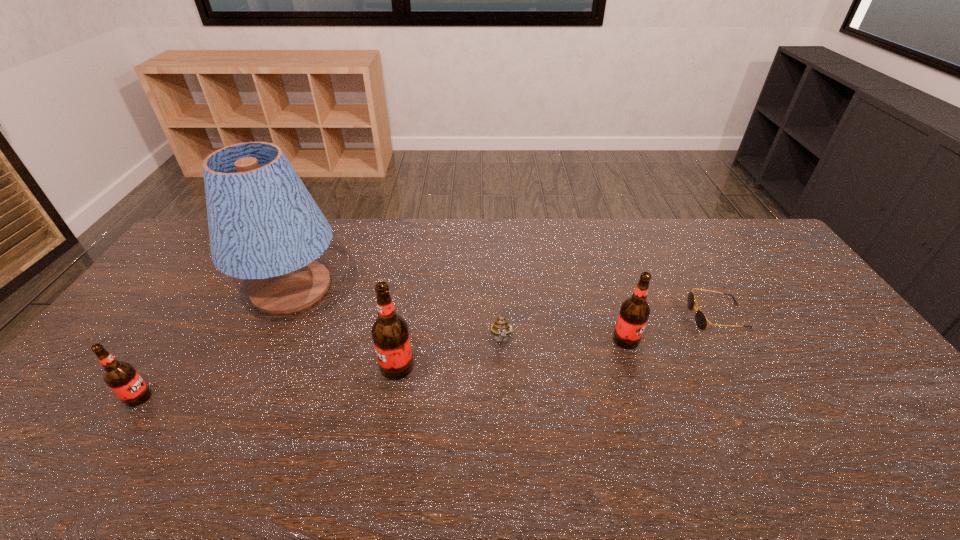
Identify the location of the leftmost object. (121, 377).

At what (x,y) coordinates should I click in order to perform the action: click on the leftmost root beer. Please return your answer as a coordinate pair (x, y). The height and width of the screenshot is (540, 960). Looking at the image, I should click on (121, 377).

You are a GUI agent. You are given a task and a screenshot of the screen. Output one action in this format:
    pyautogui.click(x=<x>, y=<y>)
    Task: Click on the second nearest root beer
    The width and height of the screenshot is (960, 540).
    Given the screenshot: What is the action you would take?
    390,333

The height and width of the screenshot is (540, 960). In order to click on the tallest root beer in this screenshot , I will do `click(390, 333)`.

This screenshot has width=960, height=540. Identify the location of the farthest root beer. (634, 312).

Find the location of a particular element. Image resolution: width=960 pixels, height=540 pixels. the fifth object from left to right is located at coordinates (634, 312).

In order to click on the second shortest object in this screenshot , I will do `click(500, 328)`.

The width and height of the screenshot is (960, 540). Identify the location of the third object from right to left. (500, 328).

Locate an element on the screen. The image size is (960, 540). the rightmost object is located at coordinates [x=700, y=318].

Find the location of a particular element. This screenshot has width=960, height=540. sunglasses is located at coordinates (700, 318).